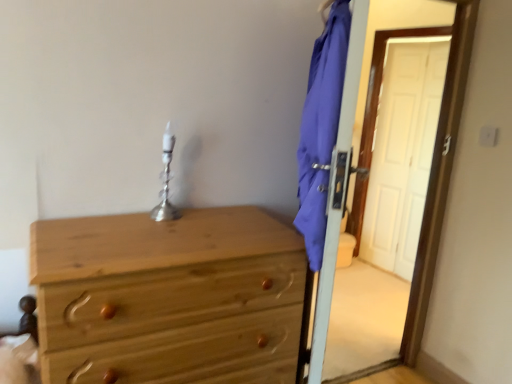
Question: Considering the positions of blue fabric screen door at right and natural wood chest of drawers at left in the image, is blue fabric screen door at right bigger or smaller than natural wood chest of drawers at left?

Choices:
 (A) big
 (B) small

Answer: (B)

Question: From a real-world perspective, is blue fabric screen door at right positioned above or below natural wood chest of drawers at left?

Choices:
 (A) below
 (B) above

Answer: (B)

Question: Which object is the farthest from the blue fabric screen door at right?

Choices:
 (A) silver metallic table lamp at center
 (B) natural wood chest of drawers at left

Answer: (B)

Question: Considering the real-world distances, which object is closest to the blue fabric screen door at right?

Choices:
 (A) silver metallic table lamp at center
 (B) natural wood chest of drawers at left

Answer: (A)